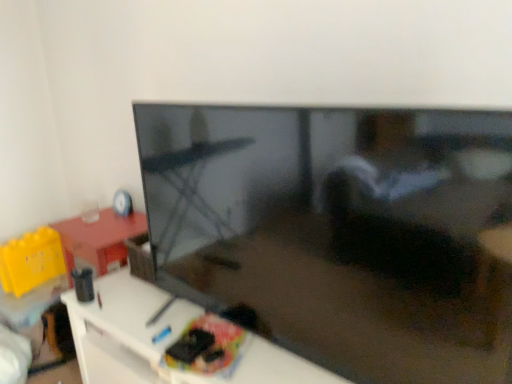
Question: Does white glossy tv stand at lower left have a larger size compared to matte black tv at center?

Choices:
 (A) yes
 (B) no

Answer: (A)

Question: Does white glossy tv stand at lower left have a smaller size compared to matte black tv at center?

Choices:
 (A) yes
 (B) no

Answer: (B)

Question: Can you confirm if white glossy tv stand at lower left is wider than matte black tv at center?

Choices:
 (A) yes
 (B) no

Answer: (A)

Question: Does white glossy tv stand at lower left have a greater height compared to matte black tv at center?

Choices:
 (A) no
 (B) yes

Answer: (A)

Question: Can you see white glossy tv stand at lower left touching matte black tv at center?

Choices:
 (A) no
 (B) yes

Answer: (A)

Question: From a real-world perspective, is white glossy tv stand at lower left on top of matte black tv at center?

Choices:
 (A) no
 (B) yes

Answer: (A)

Question: Does matte plastic cd at upper left have a lesser width compared to white glossy tv stand at lower left?

Choices:
 (A) yes
 (B) no

Answer: (A)

Question: Considering the relative sizes of matte plastic cd at upper left and white glossy tv stand at lower left in the image provided, is matte plastic cd at upper left smaller than white glossy tv stand at lower left?

Choices:
 (A) no
 (B) yes

Answer: (B)

Question: From a real-world perspective, does matte plastic cd at upper left stand above white glossy tv stand at lower left?

Choices:
 (A) no
 (B) yes

Answer: (B)

Question: Is matte plastic cd at upper left further to the viewer compared to white glossy tv stand at lower left?

Choices:
 (A) yes
 (B) no

Answer: (A)

Question: Is matte plastic cd at upper left not near white glossy tv stand at lower left?

Choices:
 (A) no
 (B) yes

Answer: (A)

Question: Would you say matte plastic cd at upper left is outside white glossy tv stand at lower left?

Choices:
 (A) yes
 (B) no

Answer: (A)

Question: Is white glossy tv stand at lower left at the left side of matte plastic cd at upper left?

Choices:
 (A) no
 (B) yes

Answer: (A)